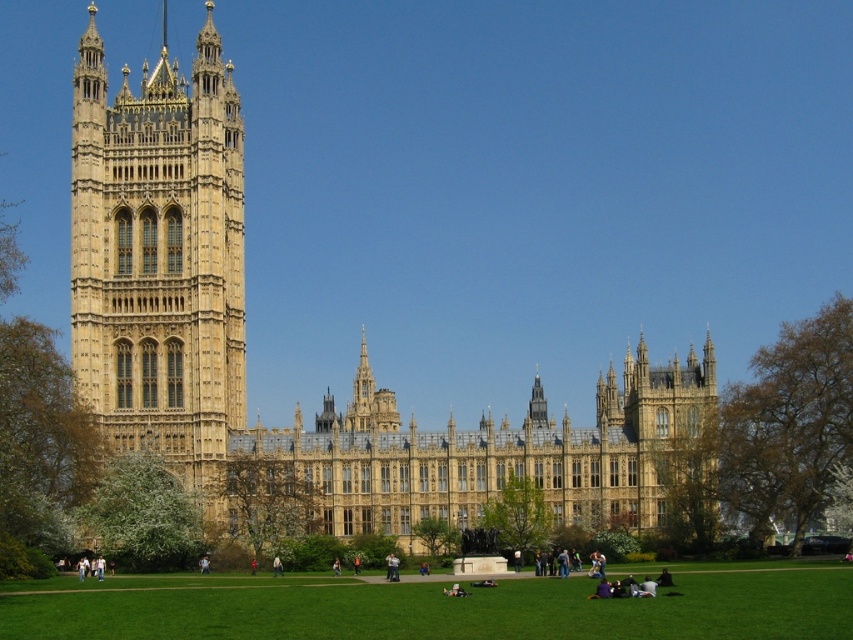
Based on the photo, you are standing in front of the Palace of Westminster and want to take a photo of the golden stone tower at left and the green grass at lower center. Which object is located to the left of the other?

The golden stone tower at left is positioned on the left side of green grass at lower center.

You are a tourist visiting the Palace of Westminster. You see the golden stone tower at left and the green grass at lower center. Which object is bigger in size?

The golden stone tower at left has a larger size compared to the green grass at lower center, so the golden stone tower at left is bigger in size.